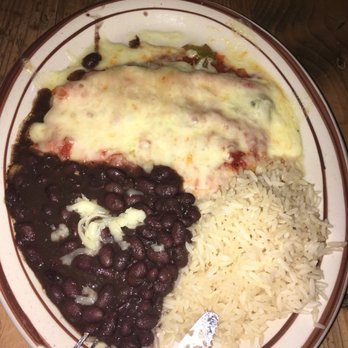
Locate an element on the screen. The width and height of the screenshot is (348, 348). plate is located at coordinates (333, 219).